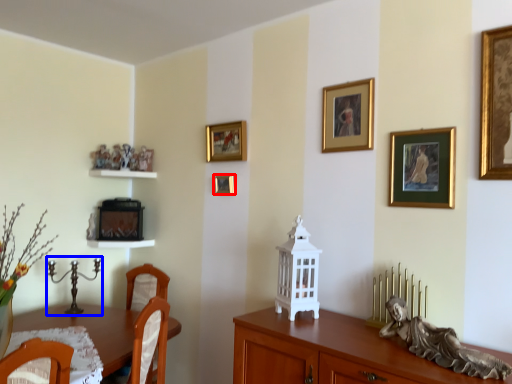
Question: Which point is further to the camera, picture frame (highlighted by a red box) or candle holder (highlighted by a blue box)?

Choices:
 (A) picture frame
 (B) candle holder

Answer: (A)